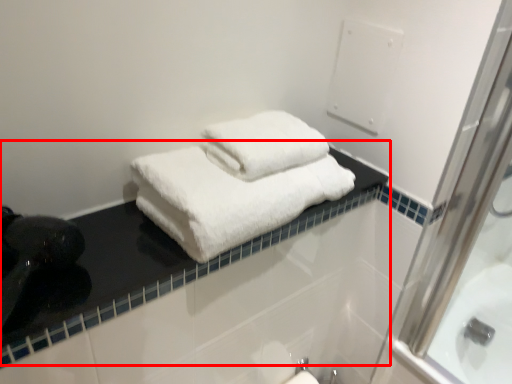
Question: From the image's perspective, what is the correct spatial relationship of counter top (annotated by the red box) in relation to towel?

Choices:
 (A) above
 (B) below

Answer: (B)